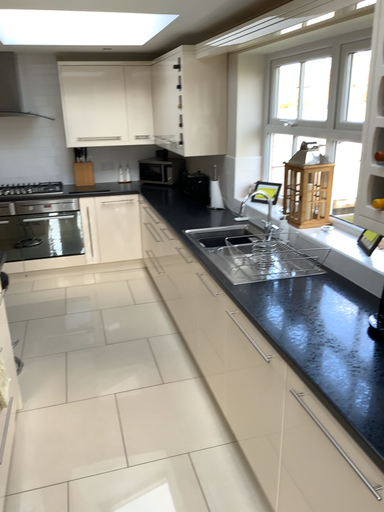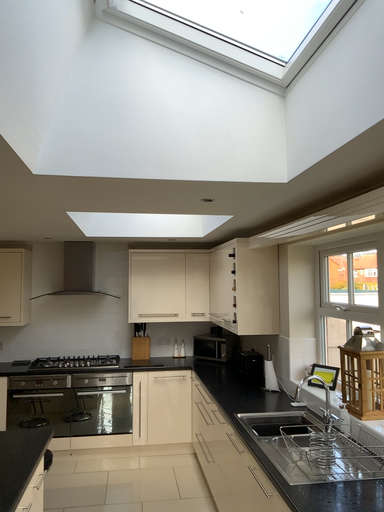
Question: How did the camera likely rotate when shooting the video?

Choices:
 (A) rotated downward
 (B) rotated upward

Answer: (B)